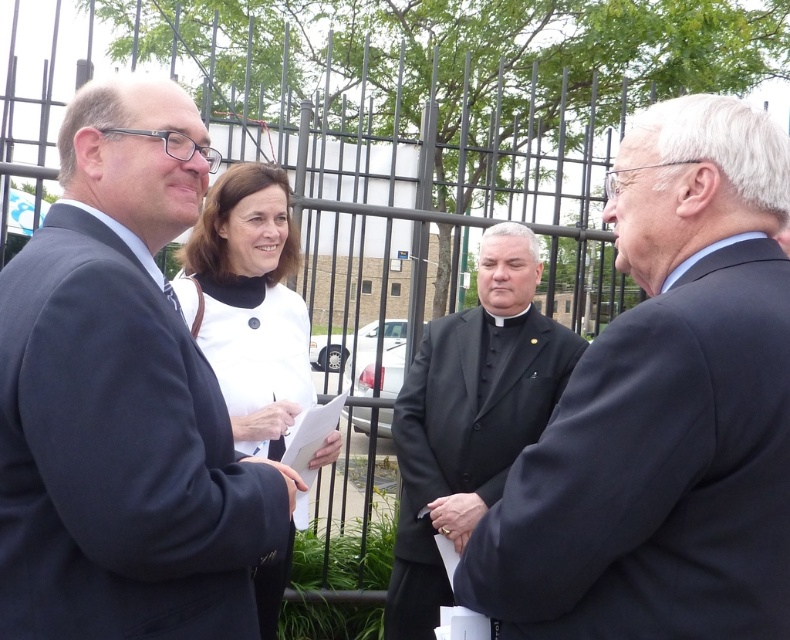
You are a photographer trying to capture a group photo of the black matte suit at right and the woman with shoulder length brown hair. The camera is at position point 0.5,0.5. Which subject is closer to the camera?

A: The black matte suit at right is at point (x=664, y=410), so the woman with shoulder length brown hair is closer to the camera since her position is not specified but the black matte suit is further away.

You are a photographer trying to capture a group photo of the black matte suit at right and the matte black suit at left. Since the two people are standing close to each other, you want to ensure there is enough space between them to fit both in the frame. Based on their current positions, do you think you can comfortably include both in a single photo without cropping either of them out?

The black matte suit at right is positioned on the right side of matte black suit at left, so they are already aligned next to each other. Since they are close, the photographer can comfortably include both in a single photo without cropping either out.